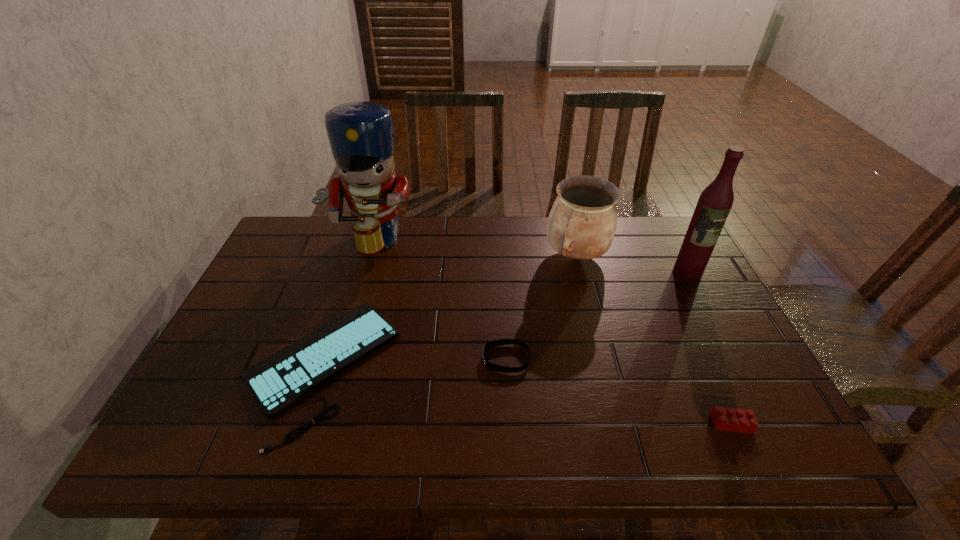
You are a GUI agent. You are given a task and a screenshot of the screen. Output one action in this format:
    pyautogui.click(x=<x>, y=<y>)
    Task: Click on the computer keyboard that is at the left edge
    This screenshot has width=960, height=540.
    Given the screenshot: What is the action you would take?
    pyautogui.click(x=277, y=381)

The image size is (960, 540). Find the location of `liquor located in the right edge section of the desktop`. liquor located in the right edge section of the desktop is located at coordinates 715,202.

Identify the location of Lego located in the right edge section of the desktop. Image resolution: width=960 pixels, height=540 pixels. (728, 419).

Identify the location of object positioned at the far left corner. Image resolution: width=960 pixels, height=540 pixels. (361, 136).

Where is `object that is at the near left corner`? This screenshot has height=540, width=960. object that is at the near left corner is located at coordinates (277, 381).

Image resolution: width=960 pixels, height=540 pixels. In order to click on object located at the near right corner in this screenshot , I will do `click(728, 419)`.

The image size is (960, 540). Identify the location of blank space at the far edge of the desktop. (454, 260).

This screenshot has width=960, height=540. In the image, there is a desktop. What are the coordinates of `vacant area at the left edge` in the screenshot? It's located at (212, 356).

Find the location of a particular element. This screenshot has width=960, height=540. free region at the right edge of the desktop is located at coordinates (754, 397).

At what (x,y) coordinates should I click in order to perform the action: click on free space at the far left corner of the desktop. Please return your answer as a coordinate pair (x, y). The image size is (960, 540). Looking at the image, I should click on (286, 230).